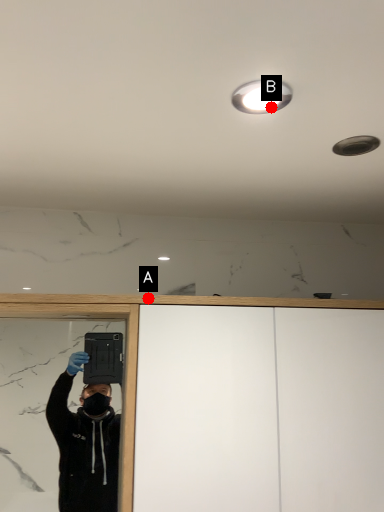
Question: Two points are circled on the image, labeled by A and B beside each circle. Which point is further to the camera?

Choices:
 (A) A is further
 (B) B is further

Answer: (A)